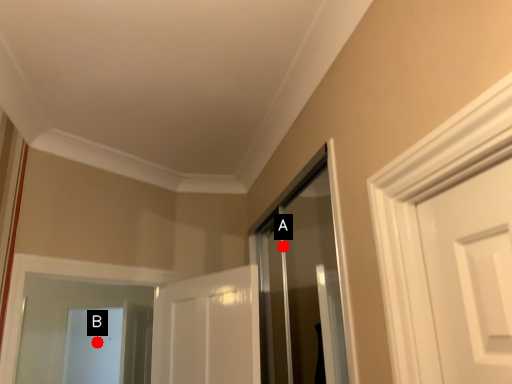
Question: Two points are circled on the image, labeled by A and B beside each circle. Which point is closer to the camera?

Choices:
 (A) A is closer
 (B) B is closer

Answer: (A)